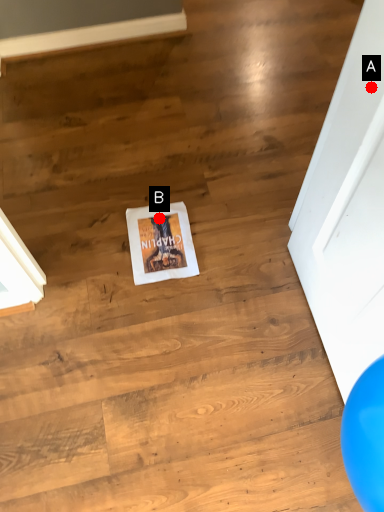
Question: Two points are circled on the image, labeled by A and B beside each circle. Among these points, which one is farthest from the camera?

Choices:
 (A) A is further
 (B) B is further

Answer: (B)